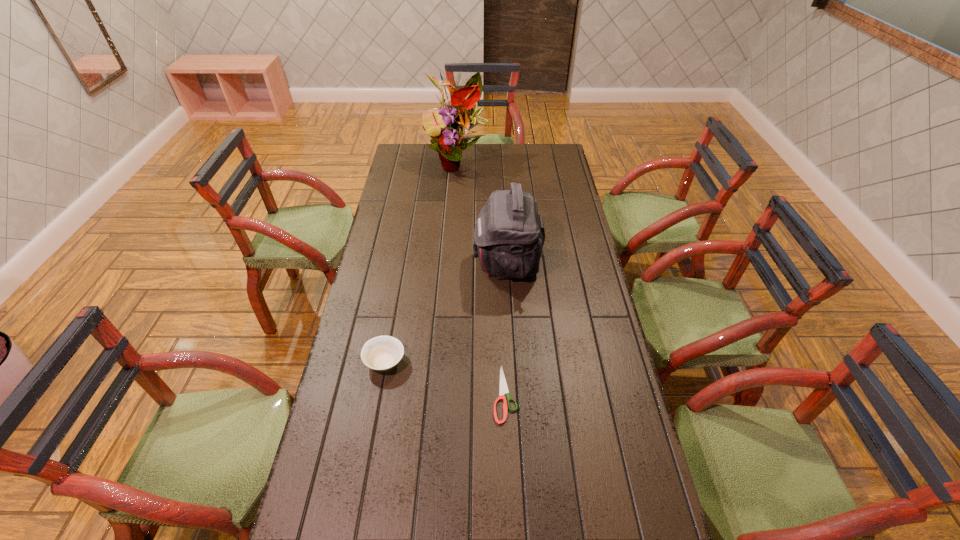
Identify the location of object identified as the closest to the shoulder bag. This screenshot has width=960, height=540. (381, 353).

Locate an element on the screen. The image size is (960, 540). vacant point that satisfies the following two spatial constraints: 1. on the open flap of the third nearest object; 2. on the front side of the third tallest object is located at coordinates (513, 361).